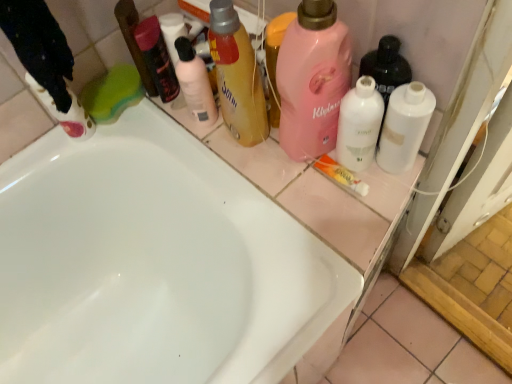
At what (x,y) coordinates should I click in order to perform the action: click on free location to the right of matte white cleaning product at left, placed as the 1th cleaning product when sorted from left to right. Please return your answer as a coordinate pair (x, y). The width and height of the screenshot is (512, 384). Looking at the image, I should click on (146, 134).